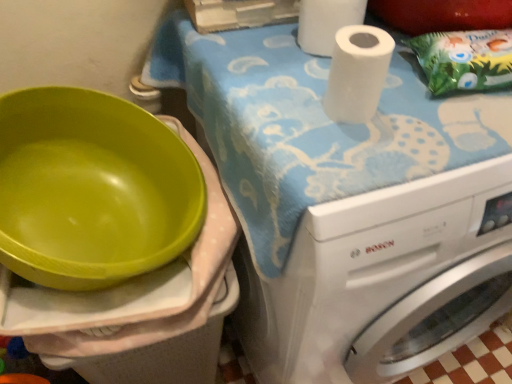
The image size is (512, 384). Describe the element at coordinates (464, 59) in the screenshot. I see `green paper bag at upper right` at that location.

The height and width of the screenshot is (384, 512). Find the location of `white matte paper towel at upper center, the first paper towel ordered from the bottom`. white matte paper towel at upper center, the first paper towel ordered from the bottom is located at coordinates (357, 73).

Measure the distance between point (x=380, y=319) and camera.

Point (x=380, y=319) and camera are 25.75 inches apart.

You are a GUI agent. You are given a task and a screenshot of the screen. Output one action in this format:
    pyautogui.click(x=<x>, y=<y>)
    Task: Click on the green paper bag at upper right
    This screenshot has width=512, height=384.
    Given the screenshot: What is the action you would take?
    pyautogui.click(x=464, y=59)

From the image's perspective, is white glossy washing machine at upper right above or below green paper bag at upper right?

white glossy washing machine at upper right is below green paper bag at upper right.

Is point (321, 239) more distant than point (486, 32)?

No, (321, 239) is in front of (486, 32).

Is white glossy washing machine at upper right beside green paper bag at upper right?

white glossy washing machine at upper right and green paper bag at upper right are clearly separated.

Considering the relative sizes of white glossy washing machine at upper right and green paper bag at upper right in the image provided, is white glossy washing machine at upper right shorter than green paper bag at upper right?

Incorrect, the height of white glossy washing machine at upper right does not fall short of that of green paper bag at upper right.

Is point (446, 306) farther from viewer compared to point (325, 50)?

Yes, point (446, 306) is farther from viewer.

Is white glossy washing machine at upper right directly adjacent to white matte paper towel at upper right, which appears as the 1th paper towel when viewed from the back?

white glossy washing machine at upper right and white matte paper towel at upper right, which appears as the 1th paper towel when viewed from the back, are not in contact.

Measure the distance between white glossy washing machine at upper right and white matte paper towel at upper right, which appears as the 1th paper towel when viewed from the back.

white glossy washing machine at upper right is 11.82 inches from white matte paper towel at upper right, which appears as the 1th paper towel when viewed from the back.

Is white glossy washing machine at upper right spatially inside white matte paper towel at upper right, the first paper towel in the top-to-bottom sequence, or outside of it?

white glossy washing machine at upper right is outside white matte paper towel at upper right, the first paper towel in the top-to-bottom sequence.

From the image's perspective, which object appears higher, green paper bag at upper right or white matte paper towel at upper right, which appears as the 1th paper towel when viewed from the back?

white matte paper towel at upper right, which appears as the 1th paper towel when viewed from the back, is shown above in the image.

Does green paper bag at upper right come in front of white matte paper towel at upper right, the first paper towel in the top-to-bottom sequence?

Yes, green paper bag at upper right is closer to the viewer.

Consider the image. Considering the sizes of objects green paper bag at upper right and white matte paper towel at upper right, the first paper towel in the top-to-bottom sequence, in the image provided, who is taller, green paper bag at upper right or white matte paper towel at upper right, the first paper towel in the top-to-bottom sequence,?

With more height is white matte paper towel at upper right, the first paper towel in the top-to-bottom sequence.

What's the angular difference between green paper bag at upper right and white matte paper towel at upper right, the first paper towel in the top-to-bottom sequence,'s facing directions?

The angular difference between green paper bag at upper right and white matte paper towel at upper right, the first paper towel in the top-to-bottom sequence, is 16.5 degrees.

From the image's perspective, which is below, white matte paper towel at upper center, the 2th paper towel from the top, or green paper bag at upper right?

white matte paper towel at upper center, the 2th paper towel from the top, is shown below in the image.

Is white matte paper towel at upper center, placed as the 1th paper towel when sorted from front to back, positioned beyond the bounds of green paper bag at upper right?

white matte paper towel at upper center, placed as the 1th paper towel when sorted from front to back, lies outside green paper bag at upper right's area.

Consider the image. Which of these two, white matte paper towel at upper center, the 2th paper towel in the back-to-front sequence, or green paper bag at upper right, is bigger?

green paper bag at upper right is bigger.

Does point (338, 102) lie in front of point (426, 41)?

Yes, it is.

Relative to white matte paper towel at upper center, placed as the 1th paper towel when sorted from front to back, is green paper bag at upper right in front or behind?

Clearly, green paper bag at upper right is behind white matte paper towel at upper center, placed as the 1th paper towel when sorted from front to back.

Is green paper bag at upper right facing away from white matte paper towel at upper center, the first paper towel ordered from the bottom?

No, white matte paper towel at upper center, the first paper towel ordered from the bottom, is not at the back of green paper bag at upper right.

Locate an element on the screen. The height and width of the screenshot is (384, 512). paper towel that is below the green paper bag at upper right (from the image's perspective) is located at coordinates (357, 73).

From a real-world perspective, is green paper bag at upper right positioned above or below white matte paper towel at upper center, the 2th paper towel from the top?

green paper bag at upper right is situated lower than white matte paper towel at upper center, the 2th paper towel from the top, in the real world.

Considering the positions of objects green paper bag at upper right and white glossy washing machine at upper right in the image provided, who is more to the right, green paper bag at upper right or white glossy washing machine at upper right?

green paper bag at upper right.

Relative to white glossy washing machine at upper right, is green paper bag at upper right in front or behind?

→ Visually, green paper bag at upper right is located behind white glossy washing machine at upper right.

Would you consider green paper bag at upper right to be distant from white glossy washing machine at upper right?

green paper bag at upper right is near white glossy washing machine at upper right, not far away.

Which of these two, white matte paper towel at upper center, the first paper towel ordered from the bottom, or white glossy washing machine at upper right, stands taller?

white glossy washing machine at upper right is taller.

What's the angular difference between white matte paper towel at upper center, the first paper towel ordered from the bottom, and white glossy washing machine at upper right's facing directions?

They differ by 0.327 degrees in their facing directions.

Considering the positions of objects white matte paper towel at upper center, the 2th paper towel from the top, and white glossy washing machine at upper right in the image provided, who is more to the left, white matte paper towel at upper center, the 2th paper towel from the top, or white glossy washing machine at upper right?

white matte paper towel at upper center, the 2th paper towel from the top, is more to the left.

From a real-world perspective, is white matte paper towel at upper center, placed as the 1th paper towel when sorted from front to back, physically above white glossy washing machine at upper right?

Yes, from a real-world perspective, white matte paper towel at upper center, placed as the 1th paper towel when sorted from front to back, is above white glossy washing machine at upper right.

Find the location of a particular element. machine that appears in front of the green paper bag at upper right is located at coordinates click(x=348, y=204).

The height and width of the screenshot is (384, 512). Identify the location of the 1st paper towel above the white glossy washing machine at upper right (from a real-world perspective). coord(326,23).

When comparing their distances from white matte paper towel at upper center, placed as the 1th paper towel when sorted from front to back, does white glossy washing machine at upper right or green paper bag at upper right seem further?

Among the two, white glossy washing machine at upper right is located further to white matte paper towel at upper center, placed as the 1th paper towel when sorted from front to back.

Looking at the image, which one is located further to white glossy washing machine at upper right, white matte paper towel at upper center, the first paper towel ordered from the bottom, or green paper bag at upper right?

green paper bag at upper right lies further to white glossy washing machine at upper right than the other object.

From the image, which object appears to be nearer to white matte paper towel at upper right, the first paper towel in the top-to-bottom sequence, white glossy washing machine at upper right or white matte paper towel at upper center, placed as the 1th paper towel when sorted from front to back?

Based on the image, white matte paper towel at upper center, placed as the 1th paper towel when sorted from front to back, appears to be nearer to white matte paper towel at upper right, the first paper towel in the top-to-bottom sequence.

Estimate the real-world distances between objects in this image. Which object is closer to white matte paper towel at upper right, which is the 2th paper towel in bottom-to-top order, white matte paper towel at upper center, the 2th paper towel in the back-to-front sequence, or white glossy washing machine at upper right?

white matte paper towel at upper center, the 2th paper towel in the back-to-front sequence, is closer to white matte paper towel at upper right, which is the 2th paper towel in bottom-to-top order.

When comparing their distances from white glossy washing machine at upper right, does white matte paper towel at upper right, which appears as the 1th paper towel when viewed from the back, or white matte paper towel at upper center, the first paper towel ordered from the bottom, seem closer?

white matte paper towel at upper center, the first paper towel ordered from the bottom.

From the image, which object appears to be nearer to white matte paper towel at upper center, the first paper towel ordered from the bottom, white matte paper towel at upper right, which appears as the 1th paper towel when viewed from the back, or white glossy washing machine at upper right?

The object closer to white matte paper towel at upper center, the first paper towel ordered from the bottom, is white matte paper towel at upper right, which appears as the 1th paper towel when viewed from the back.

When comparing their distances from green paper bag at upper right, does white glossy washing machine at upper right or white matte paper towel at upper center, the 2th paper towel in the back-to-front sequence, seem closer?

white matte paper towel at upper center, the 2th paper towel in the back-to-front sequence, lies closer to green paper bag at upper right than the other object.

Looking at the image, which one is located closer to white glossy washing machine at upper right, white matte paper towel at upper center, placed as the 1th paper towel when sorted from front to back, or white matte paper towel at upper right, which appears as the 1th paper towel when viewed from the back?

white matte paper towel at upper center, placed as the 1th paper towel when sorted from front to back.

Locate an element on the screen. This screenshot has width=512, height=384. paper towel between white matte paper towel at upper right, the 2th paper towel positioned from the front, and white glossy washing machine at upper right from top to bottom is located at coordinates (357, 73).

Identify the location of machine between white matte paper towel at upper center, the 2th paper towel in the back-to-front sequence, and green paper bag at upper right, in the horizontal direction. The height and width of the screenshot is (384, 512). (348, 204).

Find the location of `waste that lies between white matte paper towel at upper right, which is the 2th paper towel in bottom-to-top order, and white glossy washing machine at upper right from top to bottom`. waste that lies between white matte paper towel at upper right, which is the 2th paper towel in bottom-to-top order, and white glossy washing machine at upper right from top to bottom is located at coordinates (464, 59).

I want to click on paper towel between white matte paper towel at upper right, which is the 2th paper towel in bottom-to-top order, and green paper bag at upper right, so click(357, 73).